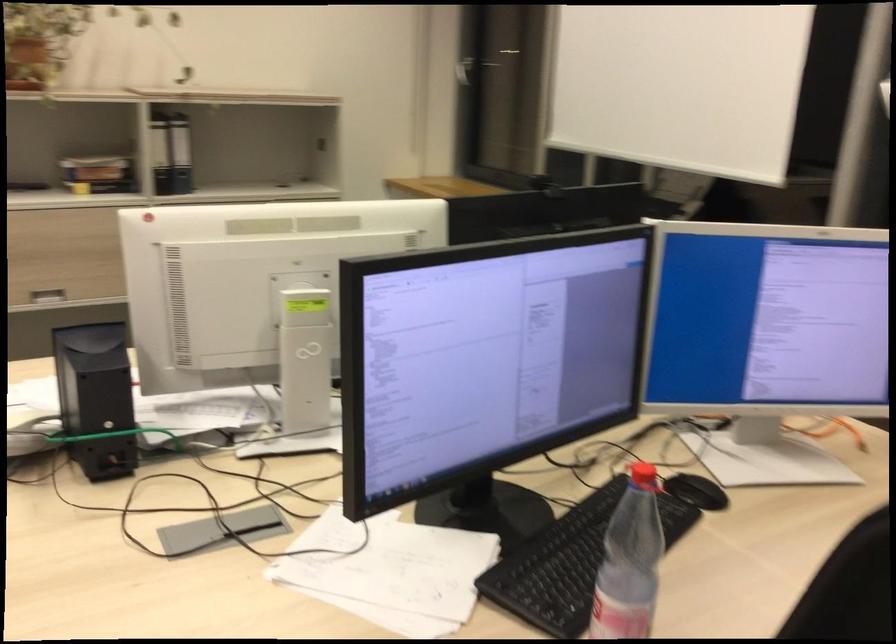
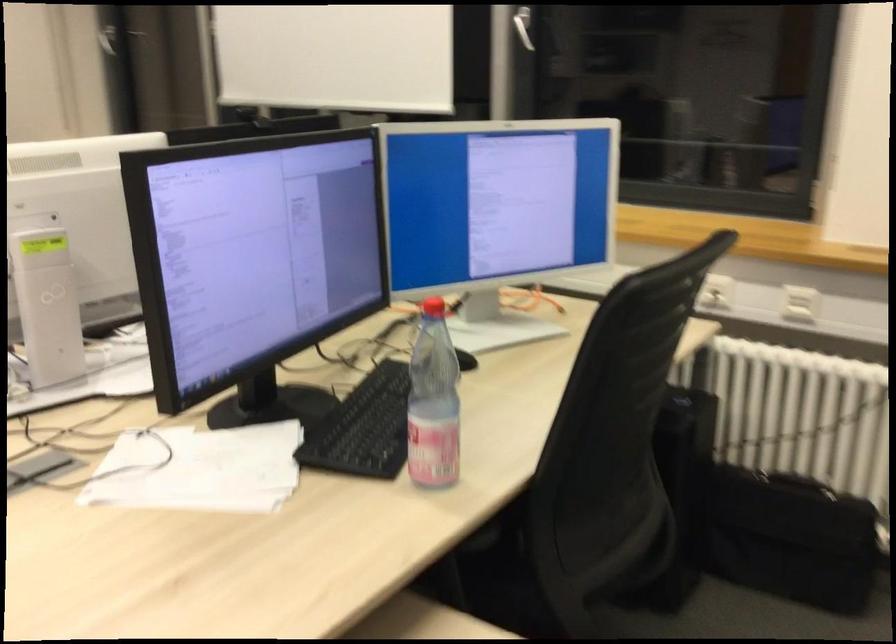
What movement of the cameraman would produce the second image?

The cameraman moved toward left, backward.